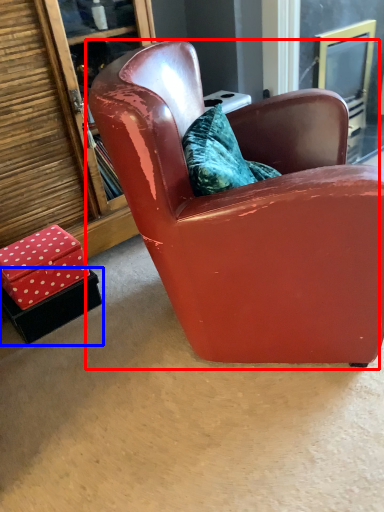
Question: Which object is further to the camera taking this photo, chair (highlighted by a red box) or box (highlighted by a blue box)?

Choices:
 (A) chair
 (B) box

Answer: (B)